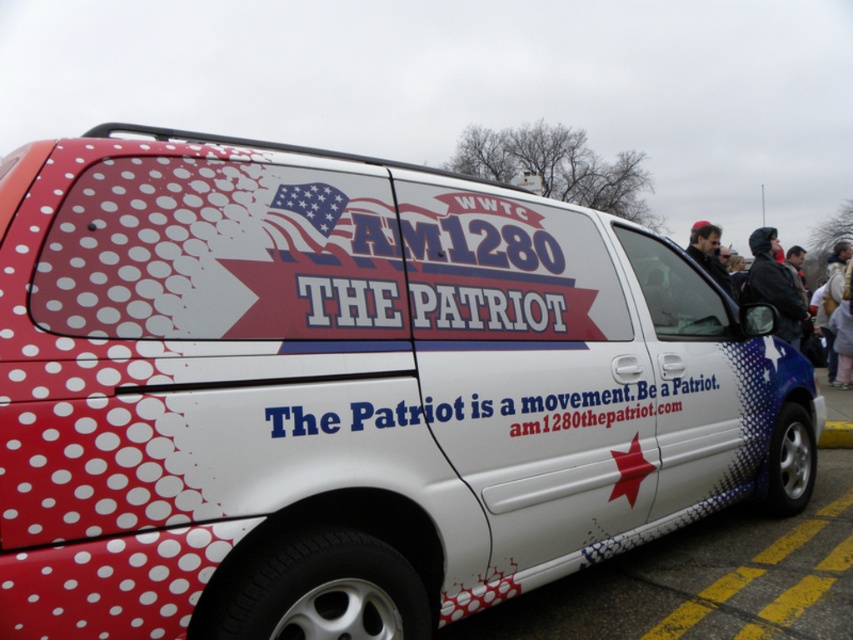
Consider the image. Is white vinyl text at center in front of dark blue jacket at right?

That is True.

Is point (587, 417) positioned after point (689, 256)?

No.

Between point (538, 406) and point (790, 316), which one is positioned in front?

Point (538, 406)

Locate an element on the screen. This screenshot has width=853, height=640. white vinyl text at center is located at coordinates (372, 416).

Which of these two, white glossy van at lower right or black leather jacket at right, stands taller?

With more height is black leather jacket at right.

Which is behind, point (480, 630) or point (798, 291)?

Point (798, 291)

The width and height of the screenshot is (853, 640). I want to click on white glossy van at lower right, so click(683, 573).

Is white glossy van at lower right to the left of dark blue jacket at right from the viewer's perspective?

Correct, you'll find white glossy van at lower right to the left of dark blue jacket at right.

Which is behind, point (822, 547) or point (786, 291)?

Positioned behind is point (786, 291).

Find the location of a particular element. white glossy van at lower right is located at coordinates (683, 573).